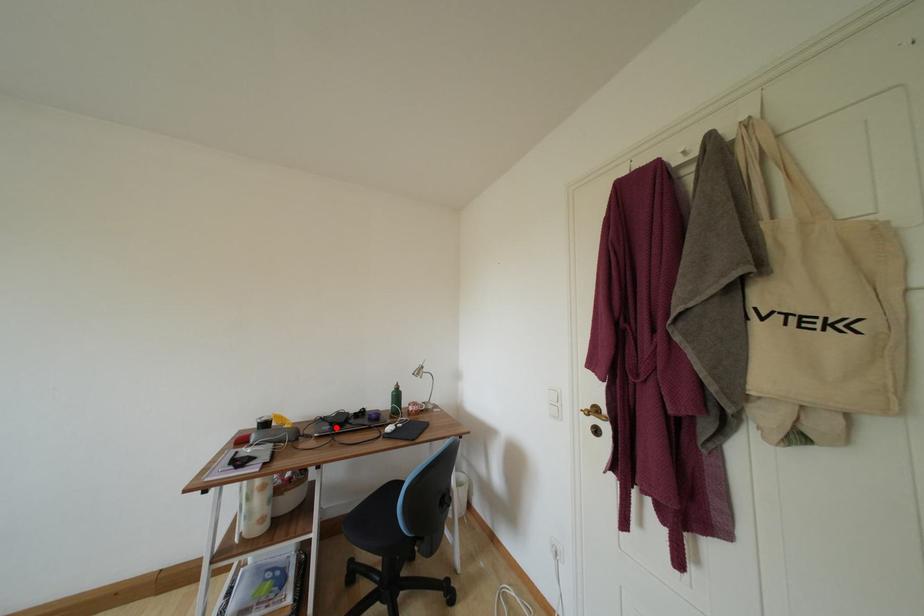
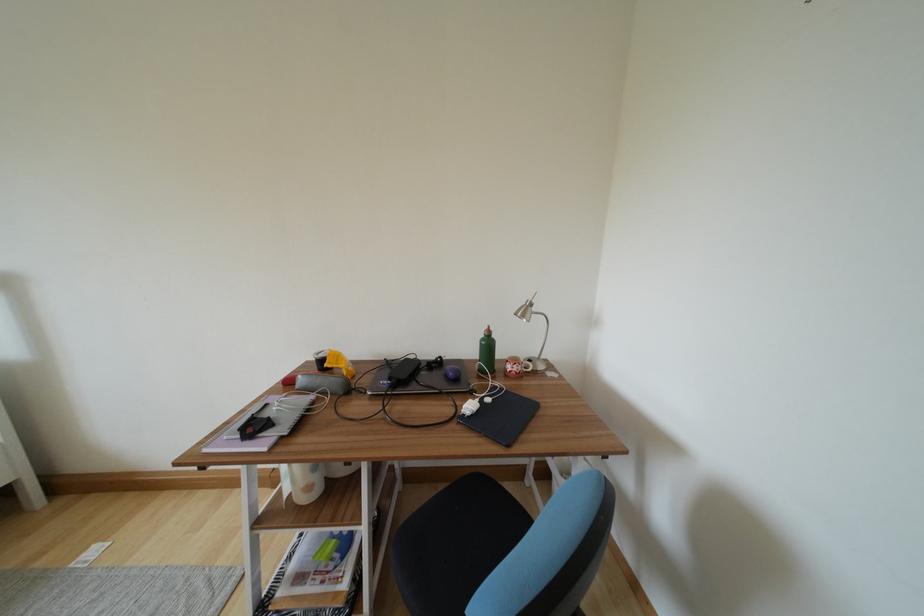
Locate, in the second image, the point that corresponds to the highlighted location in the first image.

(395, 382)